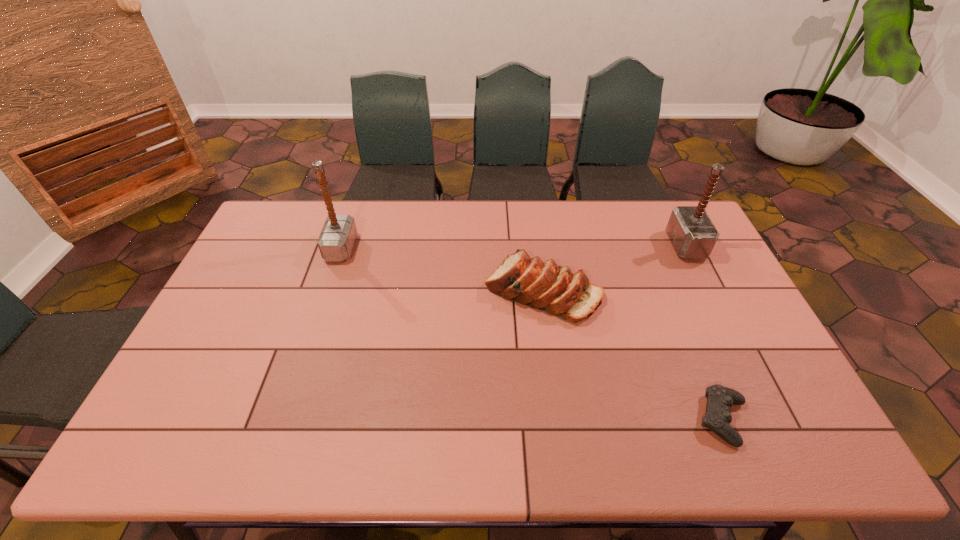
The height and width of the screenshot is (540, 960). I want to click on the leftmost object, so click(x=338, y=235).

Identify the location of the right hammer. The width and height of the screenshot is (960, 540). (693, 235).

Locate an element on the screen. This screenshot has height=540, width=960. the third tallest object is located at coordinates (554, 289).

Where is `bread`? The width and height of the screenshot is (960, 540). bread is located at coordinates pyautogui.click(x=554, y=289).

The width and height of the screenshot is (960, 540). In order to click on the nearest object in this screenshot , I will do `click(720, 399)`.

Locate an element on the screen. This screenshot has width=960, height=540. the shortest object is located at coordinates (720, 399).

You are a GUI agent. You are given a task and a screenshot of the screen. Output one action in this format:
    pyautogui.click(x=<x>, y=<y>)
    Task: Click on the vacant space situated on the striking surface of the left hammer
    
    Given the screenshot: What is the action you would take?
    381,248

The width and height of the screenshot is (960, 540). I want to click on free space located on the front of the right hammer, so click(x=713, y=301).

You are a GUI agent. You are given a task and a screenshot of the screen. Output one action in this format:
    pyautogui.click(x=<x>, y=<y>)
    Task: Click on the free space located 0.140m on the right of the bread
    This screenshot has height=540, width=960.
    Given the screenshot: What is the action you would take?
    pyautogui.click(x=645, y=291)

Locate an element on the screen. vacant region located 0.370m on the left of the shortest object is located at coordinates (544, 420).